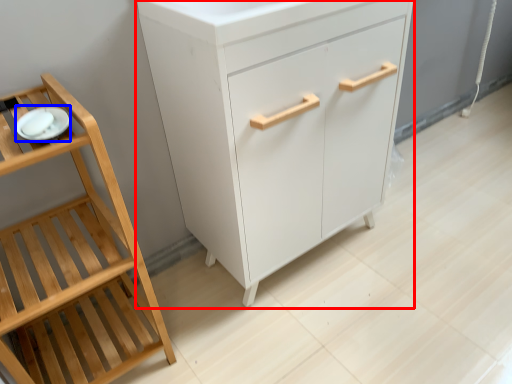
Question: Which of the following is the closest to the observer, chest of drawers (highlighted by a red box) or tableware (highlighted by a blue box)?

Choices:
 (A) chest of drawers
 (B) tableware

Answer: (B)